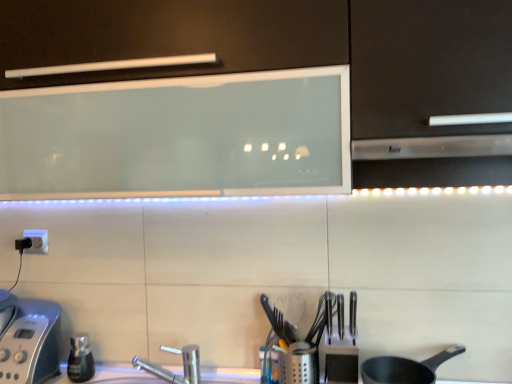
Question: Does silver metallic faucet at lower center have a greater height compared to silver metallic toaster at lower left, the 2th appliance from the right?

Choices:
 (A) no
 (B) yes

Answer: (A)

Question: Is there a large distance between silver metallic faucet at lower center and silver metallic toaster at lower left, the 2th appliance from the right?

Choices:
 (A) no
 (B) yes

Answer: (A)

Question: Is silver metallic faucet at lower center located outside silver metallic toaster at lower left, the 2th appliance from the right?

Choices:
 (A) yes
 (B) no

Answer: (A)

Question: Can you confirm if silver metallic faucet at lower center is bigger than silver metallic toaster at lower left, positioned as the 1th appliance in left-to-right order?

Choices:
 (A) no
 (B) yes

Answer: (A)

Question: Is the position of silver metallic faucet at lower center less distant than that of silver metallic toaster at lower left, positioned as the 1th appliance in left-to-right order?

Choices:
 (A) no
 (B) yes

Answer: (B)

Question: Looking at the image, does matte black frying pan at lower right seem bigger or smaller compared to silver metallic faucet at lower center?

Choices:
 (A) big
 (B) small

Answer: (A)

Question: Visually, is matte black frying pan at lower right positioned to the left or to the right of silver metallic faucet at lower center?

Choices:
 (A) right
 (B) left

Answer: (A)

Question: Is matte black frying pan at lower right taller or shorter than silver metallic faucet at lower center?

Choices:
 (A) short
 (B) tall

Answer: (A)

Question: From the image's perspective, is matte black frying pan at lower right positioned above or below silver metallic faucet at lower center?

Choices:
 (A) above
 (B) below

Answer: (A)

Question: From their relative heights in the image, would you say metallic silver utensil holder at center, the second appliance when ordered from left to right, is taller or shorter than white glossy countertop at center?

Choices:
 (A) tall
 (B) short

Answer: (A)

Question: Is metallic silver utensil holder at center, acting as the 1th appliance starting from the right, inside or outside of white glossy countertop at center?

Choices:
 (A) outside
 (B) inside

Answer: (A)

Question: Considering the positions of point (279, 347) and point (205, 377), is point (279, 347) closer or farther from the camera than point (205, 377)?

Choices:
 (A) farther
 (B) closer

Answer: (B)

Question: Based on their positions, is metallic silver utensil holder at center, acting as the 1th appliance starting from the right, located to the left or right of white glossy countertop at center?

Choices:
 (A) left
 (B) right

Answer: (B)

Question: Is point (308, 372) positioned closer to the camera than point (31, 324)?

Choices:
 (A) farther
 (B) closer

Answer: (B)

Question: From a real-world perspective, is metallic silver utensil holder at center, acting as the 1th appliance starting from the right, above or below silver metallic toaster at lower left, positioned as the 1th appliance in left-to-right order?

Choices:
 (A) below
 (B) above

Answer: (A)